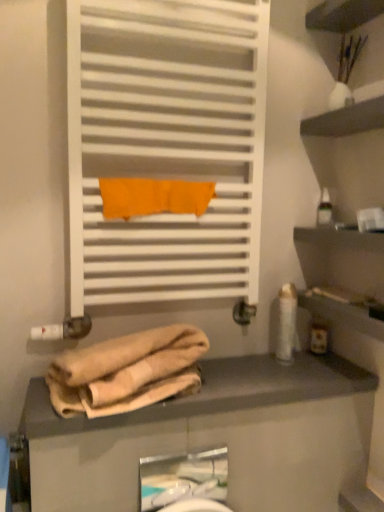
You are a GUI agent. You are given a task and a screenshot of the screen. Output one action in this format:
    pyautogui.click(x=<x>, y=<y>)
    Task: Click on the unoccupied area in front of white glossy lotion at right, the 1th toiletry in the left-to-right sequence
    
    Given the screenshot: What is the action you would take?
    pyautogui.click(x=283, y=380)